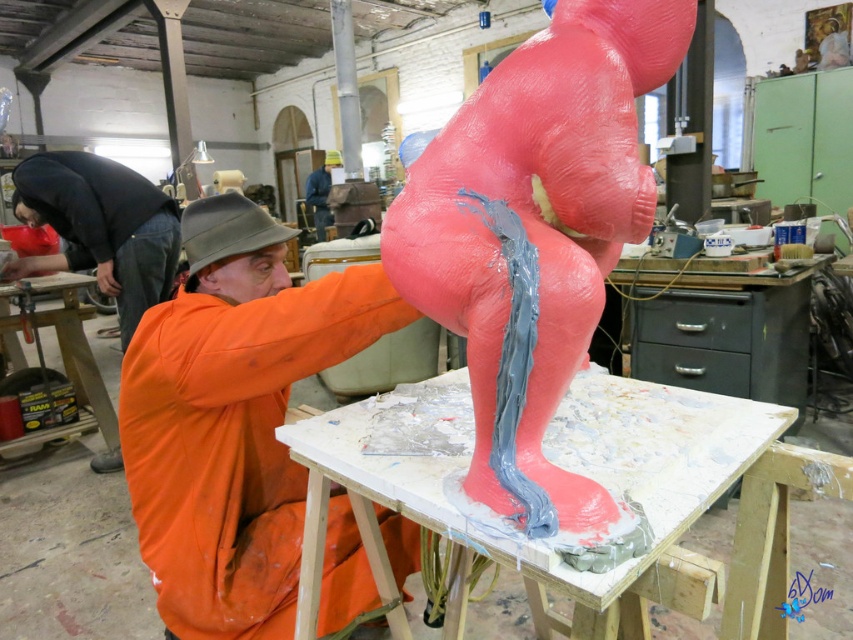
Question: Among these objects, which one is farthest from the camera?

Choices:
 (A) orange matte jacket at center
 (B) rubber-like pink sculpture at center

Answer: (A)

Question: Can you confirm if rubber-like pink sculpture at center is bigger than orange matte jacket at center?

Choices:
 (A) yes
 (B) no

Answer: (B)

Question: Can you confirm if rubber-like pink sculpture at center is wider than orange matte jacket at center?

Choices:
 (A) no
 (B) yes

Answer: (A)

Question: Among these points, which one is farthest from the camera?

Choices:
 (A) (386, 298)
 (B) (676, 20)

Answer: (A)

Question: Does rubber-like pink sculpture at center have a smaller size compared to orange matte jacket at center?

Choices:
 (A) yes
 (B) no

Answer: (A)

Question: Which object is closer to the camera taking this photo?

Choices:
 (A) orange matte jacket at center
 (B) rubber-like pink sculpture at center

Answer: (B)